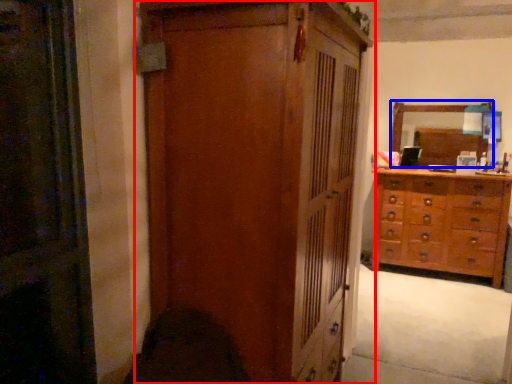
Question: Among these objects, which one is nearest to the camera, cupboard (highlighted by a red box) or mirror (highlighted by a blue box)?

Choices:
 (A) cupboard
 (B) mirror

Answer: (A)